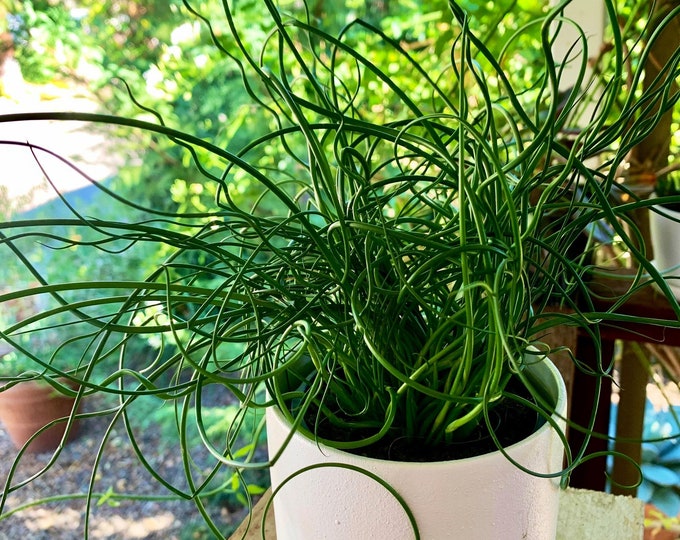
I want to click on white pots, so click(668, 231), click(460, 491).